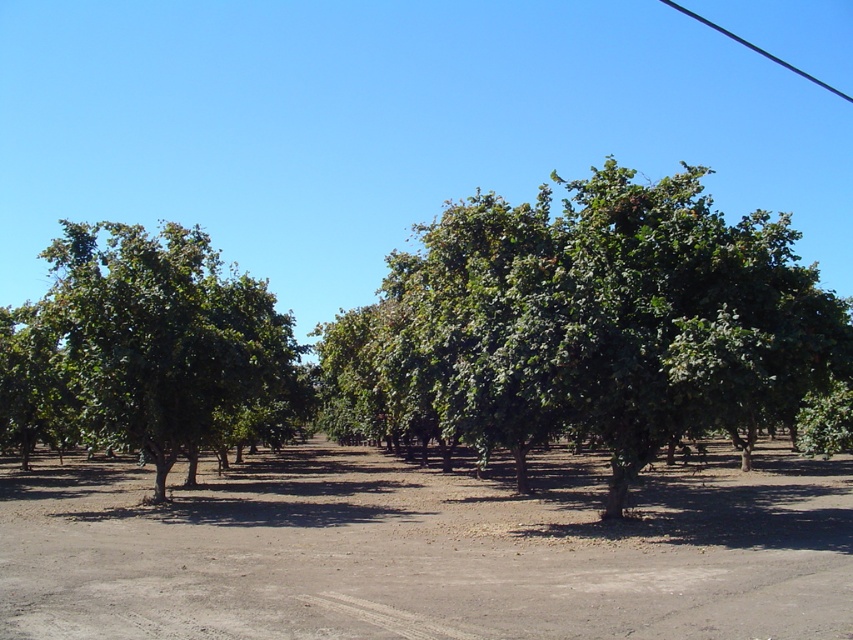
You are an orchard worker checking tree sizes. You notice the green leafy tree at center and the green leafy tree at left. Which tree requires more space in the orchard based on their sizes?

The green leafy tree at center requires more space in the orchard because it is bigger than the green leafy tree at left.

You are standing at the entrance of the orchard and want to reach the brown dirt field at center. According to the coordinates provided, in which direction should you walk from your current position to reach it?

The brown dirt field at center is located at coordinates point (x=425, y=548), so you should walk towards the center of the orchard from the entrance.

You are standing in the orchard and notice two trees. You want to walk from the green leafy tree at left to the green leafy tree at center. Which direction should you move relative to the tree at left?

You should move to the right relative to the green leafy tree at left to reach the green leafy tree at center.